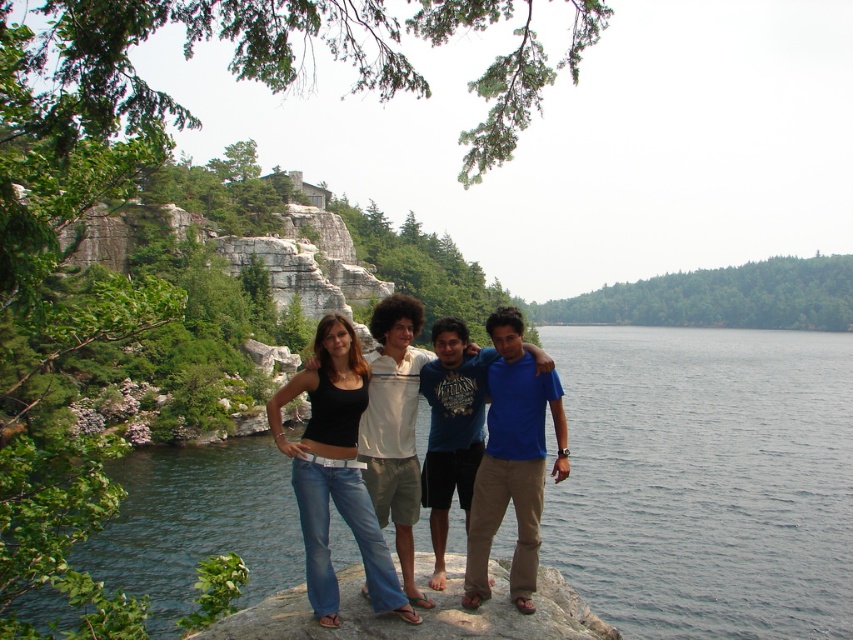
Measure the distance from black denim jeans at center to white textured shirt at center.

black denim jeans at center and white textured shirt at center are 2.50 meters apart.

Is point (310, 604) more distant than point (381, 340)?

No.

Which is behind, point (347, 513) or point (409, 316)?

Point (409, 316)

Locate an element on the screen. Image resolution: width=853 pixels, height=640 pixels. black denim jeans at center is located at coordinates (335, 472).

Does blue water at center come behind white textured shirt at center?

That is True.

Locate an element on the screen. This screenshot has height=640, width=853. blue water at center is located at coordinates (705, 480).

Can you confirm if black denim jeans at center is smaller than smooth gray rock at lower center?

Correct, black denim jeans at center occupies less space than smooth gray rock at lower center.

Which is behind, point (335, 340) or point (426, 637)?

The point (335, 340) is more distant.

Measure the distance between black denim jeans at center and camera.

They are 32.67 meters apart.

You are a GUI agent. You are given a task and a screenshot of the screen. Output one action in this format:
    pyautogui.click(x=<x>, y=<y>)
    Task: Click on the black denim jeans at center
    Image resolution: width=853 pixels, height=640 pixels.
    Given the screenshot: What is the action you would take?
    pyautogui.click(x=335, y=472)